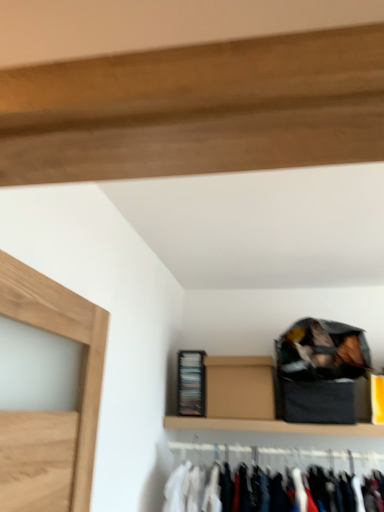
Question: Is brown cardboard box at upper center taller than black plastic cabinet at lower center?

Choices:
 (A) no
 (B) yes

Answer: (A)

Question: Can you confirm if brown cardboard box at upper center is shorter than black plastic cabinet at lower center?

Choices:
 (A) no
 (B) yes

Answer: (B)

Question: Considering the relative sizes of brown cardboard box at upper center and black plastic cabinet at lower center in the image provided, is brown cardboard box at upper center smaller than black plastic cabinet at lower center?

Choices:
 (A) no
 (B) yes

Answer: (A)

Question: From a real-world perspective, is brown cardboard box at upper center positioned under black plastic cabinet at lower center based on gravity?

Choices:
 (A) no
 (B) yes

Answer: (B)

Question: Can you confirm if brown cardboard box at upper center is bigger than black plastic cabinet at lower center?

Choices:
 (A) yes
 (B) no

Answer: (A)

Question: Does brown cardboard box at upper center touch black plastic cabinet at lower center?

Choices:
 (A) no
 (B) yes

Answer: (A)

Question: Is brown cardboard box at upper center inside black plastic cabinet at lower center?

Choices:
 (A) yes
 (B) no

Answer: (B)

Question: Is black plastic cabinet at lower center next to brown cardboard box at upper center and touching it?

Choices:
 (A) yes
 (B) no

Answer: (B)

Question: Is black plastic cabinet at lower center positioned in front of brown cardboard box at upper center?

Choices:
 (A) no
 (B) yes

Answer: (A)

Question: Considering the relative sizes of black plastic cabinet at lower center and brown cardboard box at upper center in the image provided, is black plastic cabinet at lower center wider than brown cardboard box at upper center?

Choices:
 (A) yes
 (B) no

Answer: (B)

Question: From a real-world perspective, is black plastic cabinet at lower center positioned under brown cardboard box at upper center based on gravity?

Choices:
 (A) yes
 (B) no

Answer: (B)

Question: Is black plastic cabinet at lower center bigger than brown cardboard box at upper center?

Choices:
 (A) yes
 (B) no

Answer: (B)

Question: In terms of size, does black plastic cabinet at lower center appear bigger or smaller than brown cardboard box at upper center?

Choices:
 (A) big
 (B) small

Answer: (B)